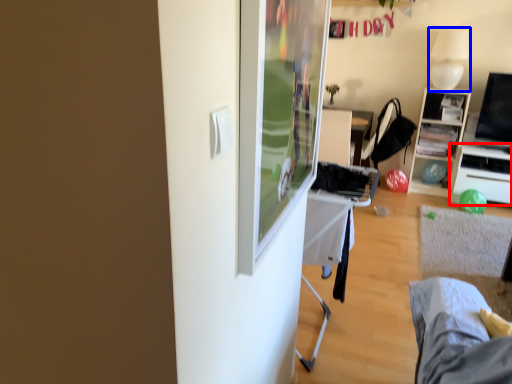
Question: Which point is further to the camera, desk (highlighted by a red box) or lamp (highlighted by a blue box)?

Choices:
 (A) desk
 (B) lamp

Answer: (A)